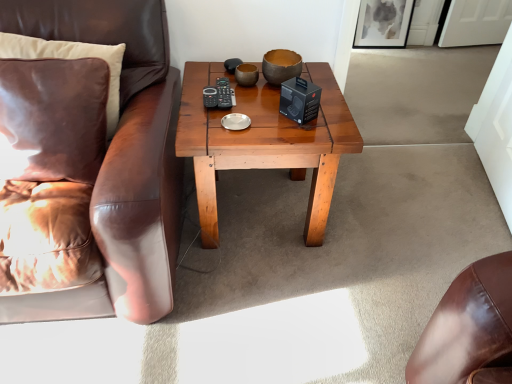
Locate an element on the screen. Image resolution: width=512 pixels, height=384 pixels. free space in front of wooden coffee table at center is located at coordinates (278, 317).